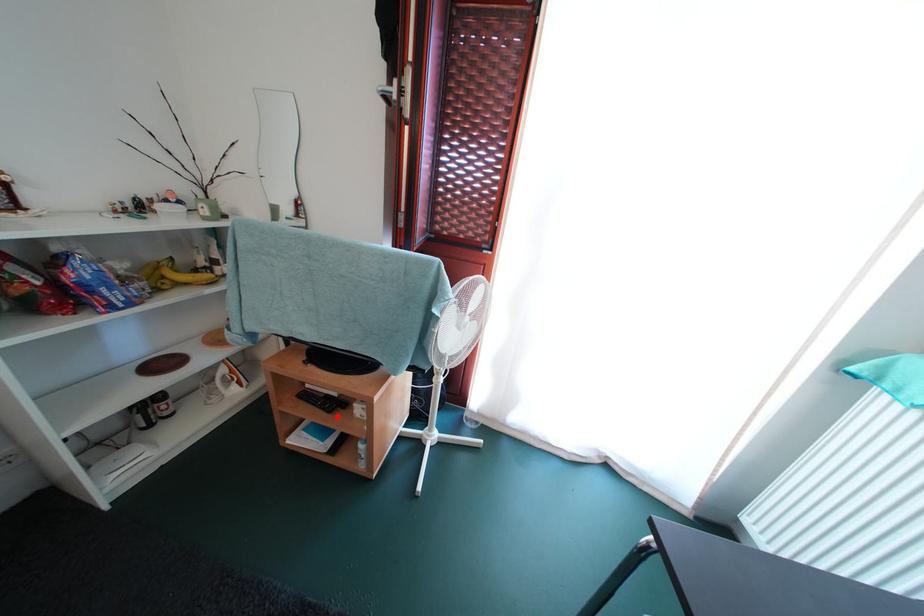
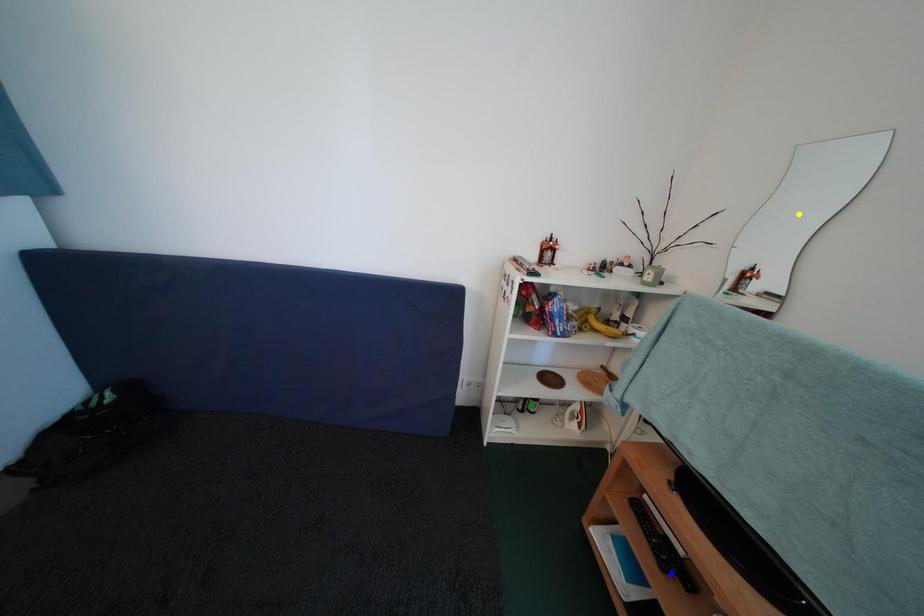
Question: I am providing you with two images of the same scene from different viewpoints. A red point is marked on the first image. You are given multiple points on the second image. Which point in image 2 represents the same 3d spot as the red point in image 1?

Choices:
 (A) green point
 (B) yellow point
 (C) blue point

Answer: (C)